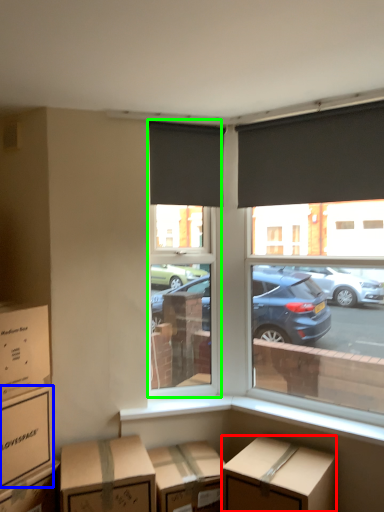
Question: Considering the real-world distances, which object is closest to box (highlighted by a red box)? box (highlighted by a blue box) or window screen (highlighted by a green box).

Choices:
 (A) box
 (B) window screen

Answer: (A)